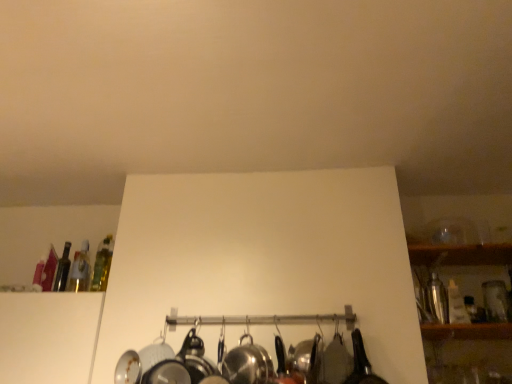
Question: Is shiny metallic shaker at right, the 4th bottle from the left, smaller than translucent glass bottle at upper left, arranged as the 1th bottle when viewed from the left?

Choices:
 (A) no
 (B) yes

Answer: (A)

Question: Is the depth of shiny metallic shaker at right, arranged as the first bottle when viewed from the right, less than that of translucent glass bottle at upper left, arranged as the 1th bottle when viewed from the left?

Choices:
 (A) yes
 (B) no

Answer: (A)

Question: From a real-world perspective, is shiny metallic shaker at right, arranged as the first bottle when viewed from the right, positioned over translucent glass bottle at upper left, which is counted as the fourth bottle, starting from the right, based on gravity?

Choices:
 (A) no
 (B) yes

Answer: (A)

Question: From the image's perspective, is shiny metallic shaker at right, arranged as the first bottle when viewed from the right, under translucent glass bottle at upper left, arranged as the 1th bottle when viewed from the left?

Choices:
 (A) no
 (B) yes

Answer: (B)

Question: Considering the relative sizes of shiny metallic shaker at right, the 4th bottle from the left, and translucent glass bottle at upper left, which is counted as the fourth bottle, starting from the right, in the image provided, is shiny metallic shaker at right, the 4th bottle from the left, taller than translucent glass bottle at upper left, which is counted as the fourth bottle, starting from the right,?

Choices:
 (A) yes
 (B) no

Answer: (B)

Question: Is translucent glass bottle at upper left, which is counted as the fourth bottle, starting from the right, surrounded by shiny metallic shaker at right, arranged as the first bottle when viewed from the right?

Choices:
 (A) yes
 (B) no

Answer: (B)

Question: Is polished stainless steel wok at center looking in the opposite direction of translucent glass bottle at upper left, which is the 2th bottle in left-to-right order?

Choices:
 (A) yes
 (B) no

Answer: (B)

Question: Is polished stainless steel wok at center taller than translucent glass bottle at upper left, the third bottle in the right-to-left sequence?

Choices:
 (A) no
 (B) yes

Answer: (A)

Question: Can you confirm if polished stainless steel wok at center is thinner than translucent glass bottle at upper left, the third bottle in the right-to-left sequence?

Choices:
 (A) yes
 (B) no

Answer: (B)

Question: Is polished stainless steel wok at center smaller than translucent glass bottle at upper left, which is the 2th bottle in left-to-right order?

Choices:
 (A) no
 (B) yes

Answer: (A)

Question: Does polished stainless steel wok at center have a lesser height compared to translucent glass bottle at upper left, which is the 2th bottle in left-to-right order?

Choices:
 (A) no
 (B) yes

Answer: (B)

Question: Considering the relative sizes of polished stainless steel wok at center and translucent glass bottle at upper left, which is the 2th bottle in left-to-right order, in the image provided, is polished stainless steel wok at center bigger than translucent glass bottle at upper left, which is the 2th bottle in left-to-right order,?

Choices:
 (A) no
 (B) yes

Answer: (B)

Question: From the image's perspective, would you say translucent glass bottle at left, which appears as the 3th bottle when viewed from the left, is shown under shiny metallic shaker at right, the 4th bottle from the left?

Choices:
 (A) yes
 (B) no

Answer: (B)